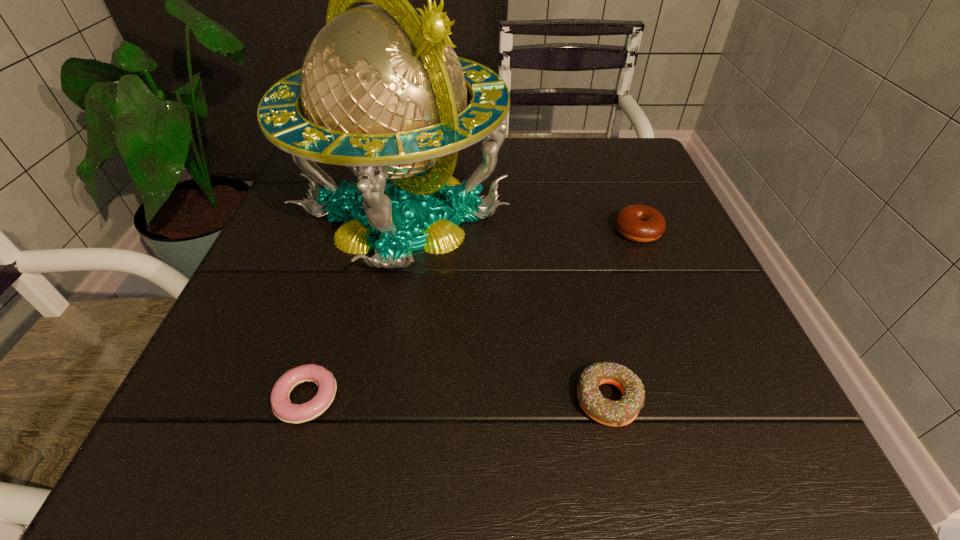
In order to click on vacant point located 0.050m on the right of the shortest doughnut in this screenshot , I will do `click(373, 398)`.

This screenshot has height=540, width=960. I want to click on object that is at the far edge, so click(x=384, y=94).

Image resolution: width=960 pixels, height=540 pixels. Find the location of `globe that is at the left edge`. globe that is at the left edge is located at coordinates (384, 94).

You are a GUI agent. You are given a task and a screenshot of the screen. Output one action in this format:
    pyautogui.click(x=<x>, y=<y>)
    Task: Click on the doughnut that is at the left edge
    
    Given the screenshot: What is the action you would take?
    click(281, 405)

I want to click on object located in the right edge section of the desktop, so click(640, 223).

Image resolution: width=960 pixels, height=540 pixels. In order to click on object at the far left corner in this screenshot , I will do `click(384, 94)`.

This screenshot has width=960, height=540. Find the location of `object at the near left corner`. object at the near left corner is located at coordinates (x=281, y=405).

The height and width of the screenshot is (540, 960). I want to click on vacant region at the far edge of the desktop, so click(507, 148).

Identify the location of free space at the left edge of the desktop. [x=307, y=261].

Find the location of a particular element. free space at the right edge of the desktop is located at coordinates (601, 214).